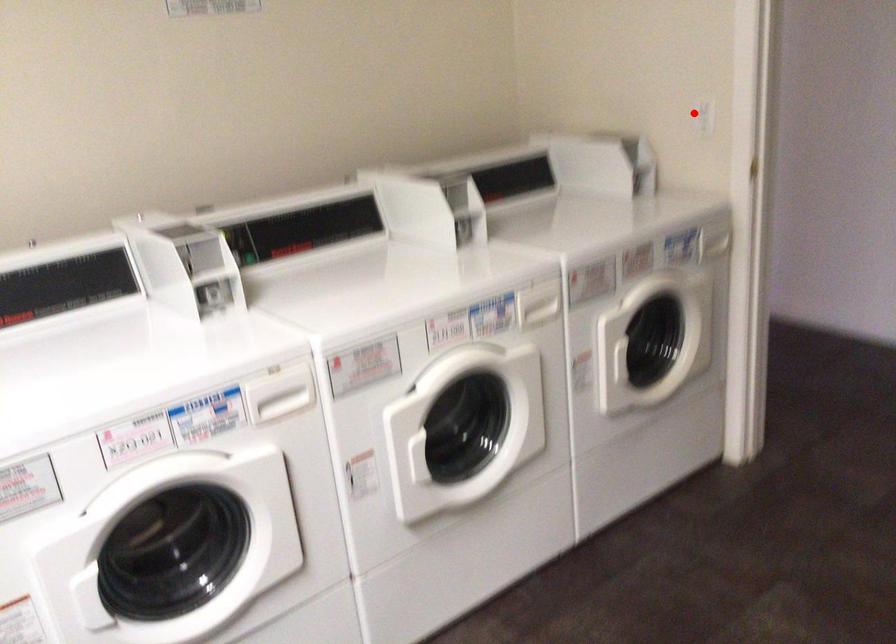
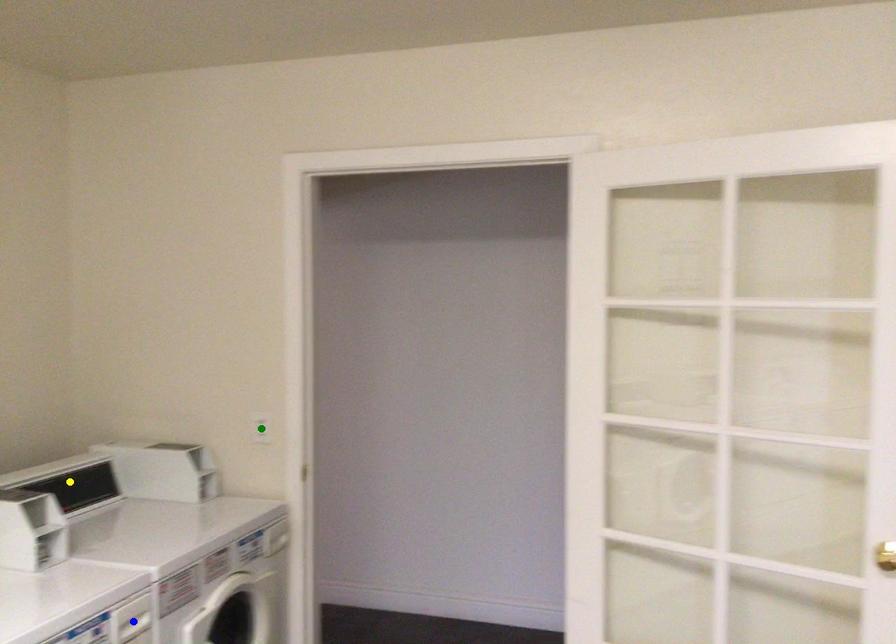
Question: I am providing you with two images of the same scene from different viewpoints. A red point is marked on the first image. You are given multiple points on the second image. Which point in image 2 is actually the same real-world point as the red point in image 1?

Choices:
 (A) yellow point
 (B) green point
 (C) blue point

Answer: (B)